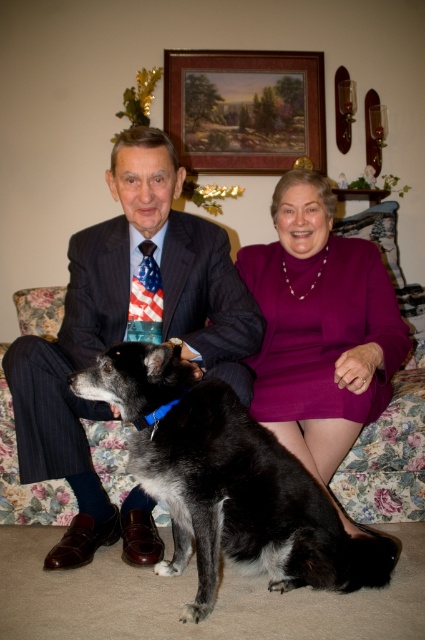
You are an interior designer assessing the living room layout. The black fur dog at center and the wooden framed painting at upper center are both in the room. Which object has a greater height?

The wooden framed painting at upper center is taller than the black fur dog at center, so the wooden framed painting at upper center has a greater height.